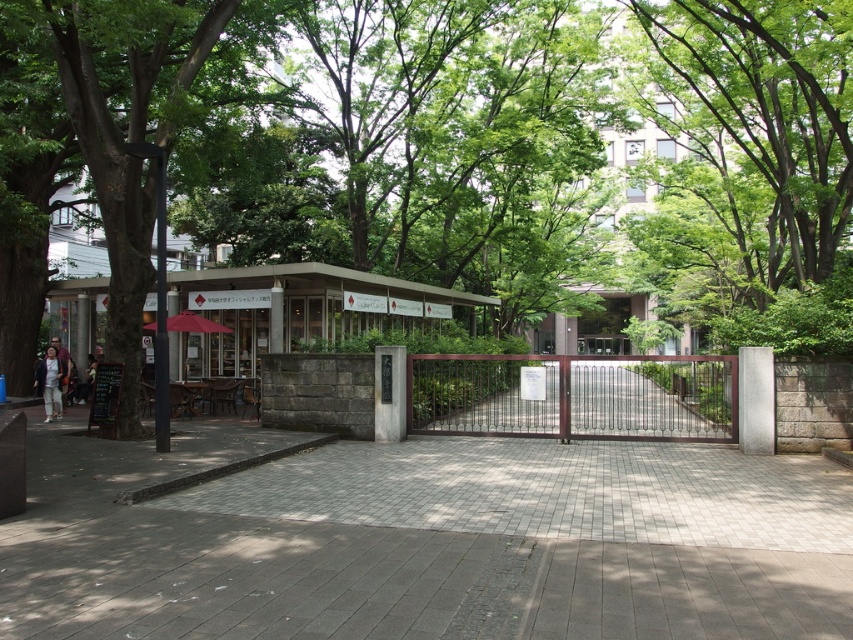
Between point (120, 260) and point (61, 372), which one is positioned in front?

Positioned in front is point (120, 260).

Between green leafy tree at center and light beige pants at left, which one is positioned lower?

light beige pants at left is lower down.

Between point (144, 12) and point (45, 353), which one is positioned in front?

Point (144, 12) is more forward.

Where is `green leafy tree at center`? This screenshot has height=640, width=853. green leafy tree at center is located at coordinates (128, 109).

Measure the distance between brown metal gate at center and light beige pants at left.

brown metal gate at center is 14.19 meters away from light beige pants at left.

Is point (515, 420) farther from camera compared to point (47, 362)?

Yes, it is behind point (47, 362).

Based on the photo, who is more forward, (682, 404) or (57, 388)?

Positioned in front is point (57, 388).

Where is `brown metal gate at center`? The image size is (853, 640). brown metal gate at center is located at coordinates [x=573, y=396].

Does gray brick pavement at center have a greater width compared to light beige pants at left?

Indeed, gray brick pavement at center has a greater width compared to light beige pants at left.

Does gray brick pavement at center have a larger size compared to light beige pants at left?

Yes, gray brick pavement at center is bigger than light beige pants at left.

Identify the location of gray brick pavement at center. (x=424, y=540).

Where is `gray brick pavement at center`? gray brick pavement at center is located at coordinates (424, 540).